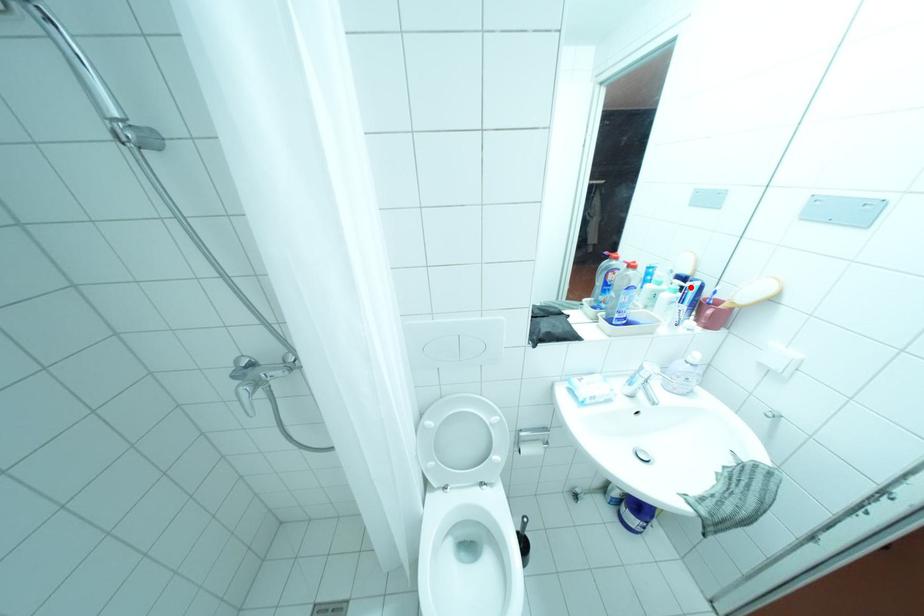
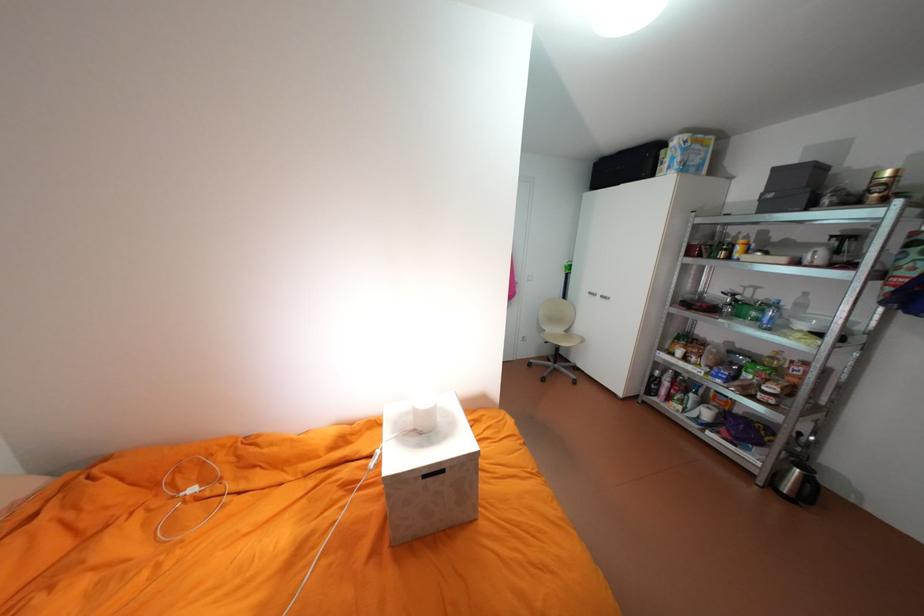
Question: I am providing you with two images of the same scene from different viewpoints. A red point is marked on the first image. Can you still see the location of the red point in image 2?

Choices:
 (A) Yes
 (B) No

Answer: (B)